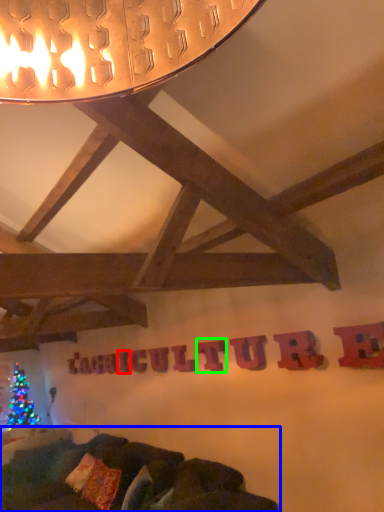
Question: Based on their relative distances, which object is nearer to letter (highlighted by a red box)? Choose from studio couch (highlighted by a blue box) and letter (highlighted by a green box).

Choices:
 (A) studio couch
 (B) letter

Answer: (A)